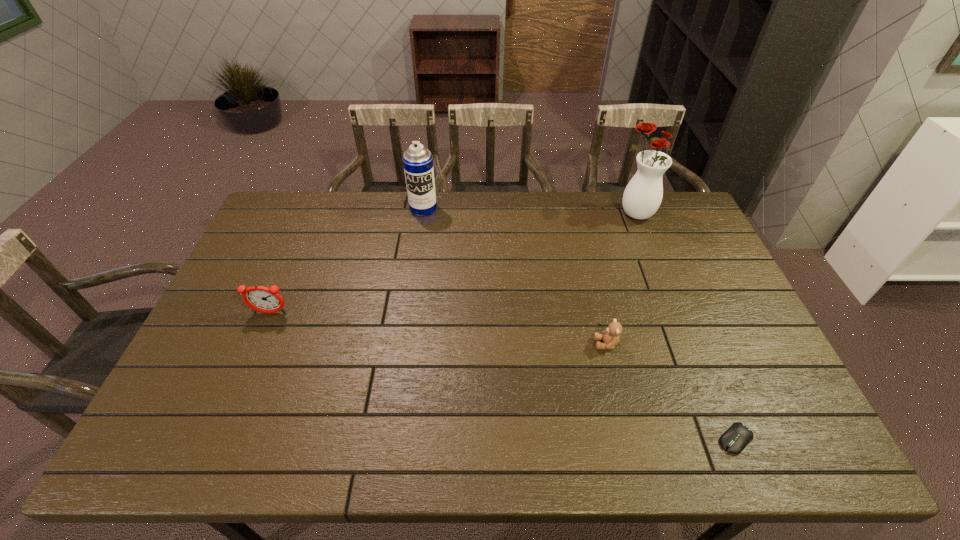
Find the location of a particular element. the third closest object to the alarm clock is located at coordinates (642, 197).

Identify the location of vacant space that satisfies the following two spatial constraints: 1. on the label side of the computer equipment; 2. on the right side of the aerosol can. The image size is (960, 540). (390, 439).

Locate an element on the screen. This screenshot has height=540, width=960. vacant point that satisfies the following two spatial constraints: 1. on the front side of the vase; 2. on the left side of the shortest object is located at coordinates (723, 439).

Identify the location of vacant space that satisfies the following two spatial constraints: 1. on the label side of the computer equipment; 2. on the left side of the fourth shortest object. The image size is (960, 540). (390, 439).

Identify the location of free space that satisfies the following two spatial constraints: 1. on the label side of the fourth shortest object; 2. on the right side of the vase. (422, 214).